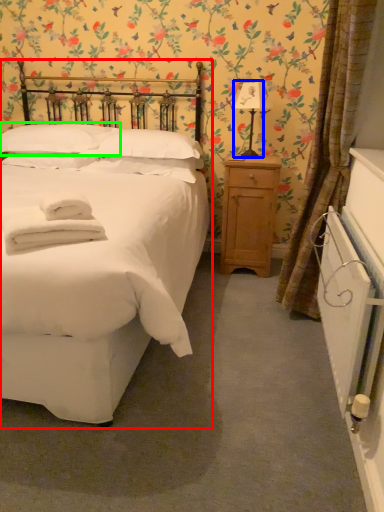
Question: Which object is the closest to the bed (highlighted by a red box)? Choose among these: table lamp (highlighted by a blue box) or pillow (highlighted by a green box).

Choices:
 (A) table lamp
 (B) pillow

Answer: (B)